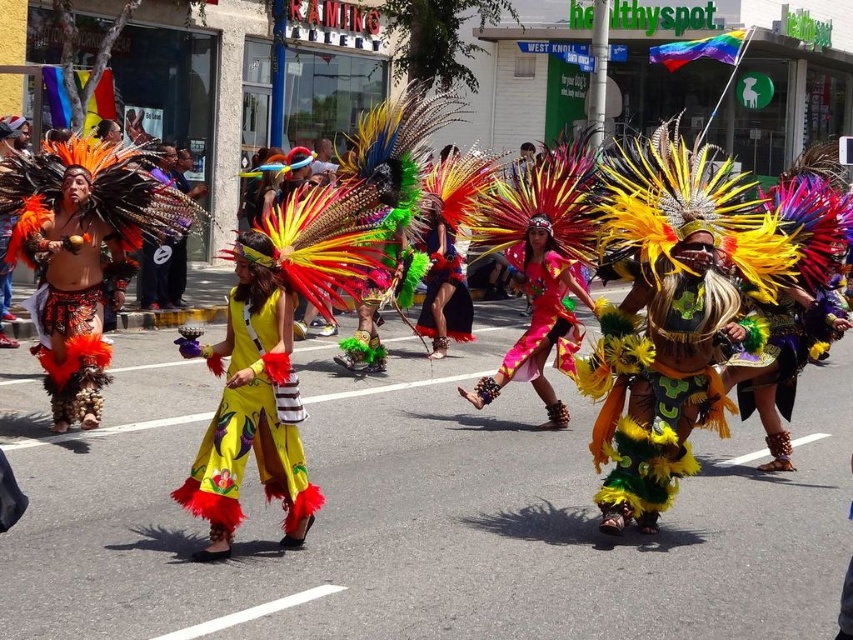
From the picture: Who is taller, matte yellow costume at center or bright yellow feathered headdress at center?

matte yellow costume at center is taller.

Looking at this image, does matte yellow costume at center have a greater width compared to bright yellow feathered headdress at center?

Correct, the width of matte yellow costume at center exceeds that of bright yellow feathered headdress at center.

Is point (99, 296) more distant than point (639, 429)?

Yes, point (99, 296) is farther from viewer.

Locate an element on the screen. matte yellow costume at center is located at coordinates (357, 202).

Describe the element at coordinates (659, 385) in the screenshot. I see `bright yellow feathered headdress at center` at that location.

Is point (720, 422) less distant than point (283, 518)?

No, (720, 422) is further to viewer.

The height and width of the screenshot is (640, 853). I want to click on bright yellow feathered headdress at center, so click(659, 385).

Is yellow satin dress at center in front of shiny pink fabric at center?

Yes, yellow satin dress at center is in front of shiny pink fabric at center.

Is point (270, 324) positioned in front of point (537, 340)?

That is True.

What are the coordinates of `yellow satin dress at center` in the screenshot? It's located at (250, 419).